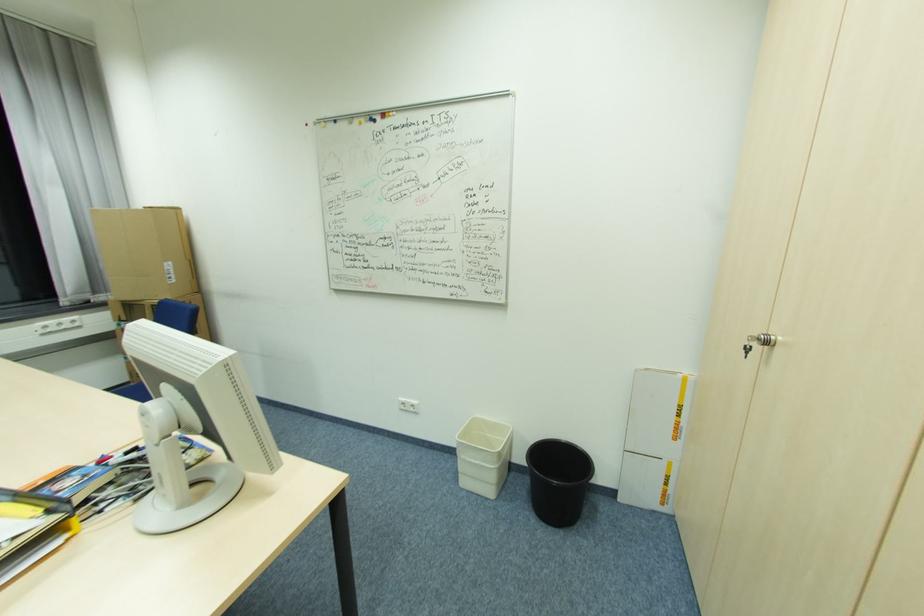
Image resolution: width=924 pixels, height=616 pixels. I want to click on silver cabinet lock, so click(x=758, y=342).